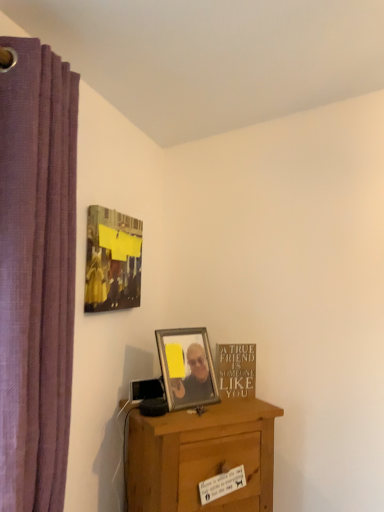
The width and height of the screenshot is (384, 512). What do you see at coordinates (201, 457) in the screenshot?
I see `wooden desk at lower center` at bounding box center [201, 457].

The height and width of the screenshot is (512, 384). Find the location of `purple fabric curtain at left`. purple fabric curtain at left is located at coordinates (36, 273).

How much space does metallic silver picture frame at center, which is the second picture frame from left to right, occupy horizontally?

metallic silver picture frame at center, which is the second picture frame from left to right, is 13.80 centimeters wide.

Locate an element on the screen. The width and height of the screenshot is (384, 512). matte black picture frame at upper left, the second picture frame from the right is located at coordinates (112, 260).

Identify the location of gold metallic sign at lower right. (236, 370).

Image resolution: width=384 pixels, height=512 pixels. In order to click on wooden desk at lower center in this screenshot , I will do `click(201, 457)`.

Can you confirm if purple fabric curtain at left is smaller than metallic silver picture frame at center, the first picture frame when ordered from bottom to top?

Incorrect, purple fabric curtain at left is not smaller in size than metallic silver picture frame at center, the first picture frame when ordered from bottom to top.

From the image's perspective, is purple fabric curtain at left positioned above or below metallic silver picture frame at center, which is the second picture frame from left to right?

Clearly, from the image's perspective, purple fabric curtain at left is above metallic silver picture frame at center, which is the second picture frame from left to right.

Is purple fabric curtain at left inside or outside of metallic silver picture frame at center, which is the second picture frame from left to right?

purple fabric curtain at left is not enclosed by metallic silver picture frame at center, which is the second picture frame from left to right.

Would you say purple fabric curtain at left is a long distance from metallic silver picture frame at center, acting as the 2th picture frame starting from the top?

They are positioned close to each other.

How different are the orientations of wooden desk at lower center and metallic silver picture frame at center, which is the second picture frame from left to right, in degrees?

There is a 7.51-degree angle between the facing directions of wooden desk at lower center and metallic silver picture frame at center, which is the second picture frame from left to right.

Can you confirm if wooden desk at lower center is positioned to the left of metallic silver picture frame at center, which appears as the first picture frame when viewed from the right?

No, wooden desk at lower center is not to the left of metallic silver picture frame at center, which appears as the first picture frame when viewed from the right.

Considering the sizes of wooden desk at lower center and metallic silver picture frame at center, acting as the 2th picture frame starting from the top, in the image, is wooden desk at lower center taller or shorter than metallic silver picture frame at center, acting as the 2th picture frame starting from the top,?

wooden desk at lower center is taller than metallic silver picture frame at center, acting as the 2th picture frame starting from the top.

Measure the distance from wooden desk at lower center to metallic silver picture frame at center, which is the second picture frame from left to right.

wooden desk at lower center and metallic silver picture frame at center, which is the second picture frame from left to right, are 7.78 inches apart.

Is the depth of purple fabric curtain at left greater than that of matte black picture frame at upper left, which is the 2th picture frame from bottom to top?

No, it is not.

Is purple fabric curtain at left aimed at matte black picture frame at upper left, the second picture frame from the right?

No, purple fabric curtain at left is not aimed at matte black picture frame at upper left, the second picture frame from the right.

Can matte black picture frame at upper left, the second picture frame from the right, be found inside purple fabric curtain at left?

No, matte black picture frame at upper left, the second picture frame from the right, is not inside purple fabric curtain at left.

From the image's perspective, who appears lower, purple fabric curtain at left or matte black picture frame at upper left, the second picture frame from the right?

purple fabric curtain at left, from the image's perspective.

From a real-world perspective, which object stands above the other?

matte black picture frame at upper left, the second picture frame from the right, is physically above.

Considering the sizes of objects wooden desk at lower center and matte black picture frame at upper left, the second picture frame from the right, in the image provided, who is shorter, wooden desk at lower center or matte black picture frame at upper left, the second picture frame from the right,?

matte black picture frame at upper left, the second picture frame from the right, is shorter.

Image resolution: width=384 pixels, height=512 pixels. I want to click on desk that appears on the right of matte black picture frame at upper left, placed as the first picture frame when sorted from top to bottom, so click(201, 457).

From the image's perspective, which one is positioned higher, wooden desk at lower center or matte black picture frame at upper left, placed as the first picture frame when sorted from top to bottom?

From the image's view, matte black picture frame at upper left, placed as the first picture frame when sorted from top to bottom, is above.

Between matte black picture frame at upper left, placed as the first picture frame when sorted from top to bottom, and metallic silver picture frame at center, which appears as the first picture frame when viewed from the right, which one has larger size?

Bigger between the two is matte black picture frame at upper left, placed as the first picture frame when sorted from top to bottom.

In the scene shown: Relative to metallic silver picture frame at center, which appears as the first picture frame when viewed from the right, is matte black picture frame at upper left, the second picture frame from the right, in front or behind?

In the image, matte black picture frame at upper left, the second picture frame from the right, appears in front of metallic silver picture frame at center, which appears as the first picture frame when viewed from the right.

From a real-world perspective, between matte black picture frame at upper left, the second picture frame from the right, and metallic silver picture frame at center, which is the second picture frame from left to right, who is vertically higher?

matte black picture frame at upper left, the second picture frame from the right, from a real-world perspective.

Considering the relative sizes of metallic silver picture frame at center, acting as the 2th picture frame starting from the top, and purple fabric curtain at left in the image provided, is metallic silver picture frame at center, acting as the 2th picture frame starting from the top, wider than purple fabric curtain at left?

In fact, metallic silver picture frame at center, acting as the 2th picture frame starting from the top, might be narrower than purple fabric curtain at left.

From the image's perspective, is metallic silver picture frame at center, acting as the 2th picture frame starting from the top, above purple fabric curtain at left?

No, from the image's perspective, metallic silver picture frame at center, acting as the 2th picture frame starting from the top, is not on top of purple fabric curtain at left.

Is purple fabric curtain at left located within metallic silver picture frame at center, acting as the 2th picture frame starting from the top?

No, purple fabric curtain at left is not inside metallic silver picture frame at center, acting as the 2th picture frame starting from the top.

Can you confirm if metallic silver picture frame at center, which is the second picture frame from left to right, is shorter than purple fabric curtain at left?

Indeed, metallic silver picture frame at center, which is the second picture frame from left to right, has a lesser height compared to purple fabric curtain at left.

Can you confirm if purple fabric curtain at left is wider than gold metallic sign at lower right?

Correct, the width of purple fabric curtain at left exceeds that of gold metallic sign at lower right.

Is point (36, 249) positioned before point (221, 395)?

Yes.

How far apart are purple fabric curtain at left and gold metallic sign at lower right?

A distance of 35.77 inches exists between purple fabric curtain at left and gold metallic sign at lower right.

From the image's perspective, who appears lower, purple fabric curtain at left or gold metallic sign at lower right?

gold metallic sign at lower right, from the image's perspective.

Locate an element on the screen. This screenshot has width=384, height=512. curtain above the metallic silver picture frame at center, which appears as the first picture frame when viewed from the right (from the image's perspective) is located at coordinates (36, 273).

From a real-world perspective, which picture frame is the 1st one above the wooden desk at lower center? Please provide its 2D coordinates.

[(187, 367)]

Estimate the real-world distances between objects in this image. Which object is closer to wooden desk at lower center, metallic silver picture frame at center, the first picture frame when ordered from bottom to top, or matte black picture frame at upper left, placed as the first picture frame when sorted from top to bottom?

metallic silver picture frame at center, the first picture frame when ordered from bottom to top.

Looking at the image, which one is located further to metallic silver picture frame at center, acting as the 2th picture frame starting from the top, wooden desk at lower center or gold metallic sign at lower right?

wooden desk at lower center lies further to metallic silver picture frame at center, acting as the 2th picture frame starting from the top, than the other object.

Based on their spatial positions, is matte black picture frame at upper left, which is the 2th picture frame from bottom to top, or metallic silver picture frame at center, acting as the 2th picture frame starting from the top, closer to purple fabric curtain at left?

Among the two, matte black picture frame at upper left, which is the 2th picture frame from bottom to top, is located nearer to purple fabric curtain at left.

When comparing their distances from metallic silver picture frame at center, which is the second picture frame from left to right, does gold metallic sign at lower right or wooden desk at lower center seem closer?

gold metallic sign at lower right is closer to metallic silver picture frame at center, which is the second picture frame from left to right.

Looking at the image, which one is located closer to purple fabric curtain at left, gold metallic sign at lower right or matte black picture frame at upper left, placed as the first picture frame when sorted from top to bottom?

The object closer to purple fabric curtain at left is matte black picture frame at upper left, placed as the first picture frame when sorted from top to bottom.

Which object lies nearer to the anchor point gold metallic sign at lower right, metallic silver picture frame at center, which appears as the first picture frame when viewed from the right, or matte black picture frame at upper left, which is the 2th picture frame from bottom to top?

The object closer to gold metallic sign at lower right is metallic silver picture frame at center, which appears as the first picture frame when viewed from the right.

Considering their positions, is matte black picture frame at upper left, which is the 2th picture frame from bottom to top, positioned closer to metallic silver picture frame at center, acting as the 2th picture frame starting from the top, than gold metallic sign at lower right?

Among the two, gold metallic sign at lower right is located nearer to metallic silver picture frame at center, acting as the 2th picture frame starting from the top.

From the image, which object appears to be farther from gold metallic sign at lower right, purple fabric curtain at left or wooden desk at lower center?

purple fabric curtain at left.

Where is `writing between matte black picture frame at upper left, placed as the first picture frame when sorted from top to bottom, and wooden desk at lower center, in the vertical direction`? writing between matte black picture frame at upper left, placed as the first picture frame when sorted from top to bottom, and wooden desk at lower center, in the vertical direction is located at coordinates (236, 370).

Find the location of a particular element. The width and height of the screenshot is (384, 512). desk between purple fabric curtain at left and gold metallic sign at lower right along the z-axis is located at coordinates (201, 457).

At what (x,y) coordinates should I click in order to perform the action: click on desk between purple fabric curtain at left and metallic silver picture frame at center, which appears as the first picture frame when viewed from the right, along the z-axis. Please return your answer as a coordinate pair (x, y). The height and width of the screenshot is (512, 384). Looking at the image, I should click on point(201,457).

Find the location of a particular element. This screenshot has height=512, width=384. writing between metallic silver picture frame at center, acting as the 2th picture frame starting from the top, and wooden desk at lower center in the up-down direction is located at coordinates (236, 370).